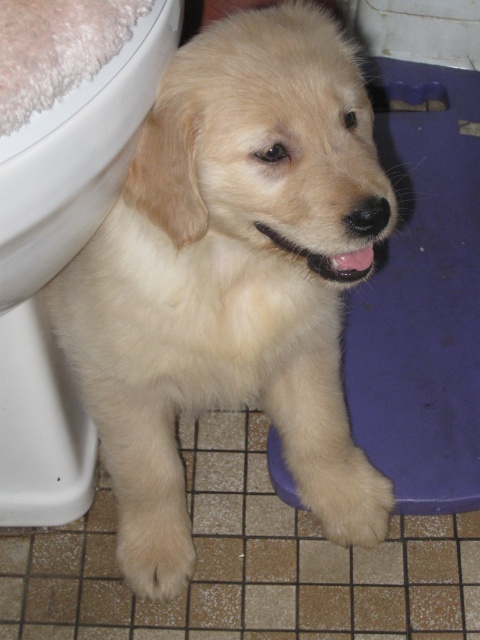
Question: Among these objects, which one is farthest from the camera?

Choices:
 (A) white glossy toilet bowl at lower left
 (B) white fluffy paw at lower left

Answer: (B)

Question: Which object appears farthest from the camera in this image?

Choices:
 (A) white glossy toilet bowl at lower left
 (B) white fluffy paw at lower center

Answer: (B)

Question: Does white glossy toilet bowl at lower left lie in front of white fluffy paw at lower center?

Choices:
 (A) yes
 (B) no

Answer: (A)

Question: Is white fluffy paw at lower center thinner than white fluffy paw at lower left?

Choices:
 (A) no
 (B) yes

Answer: (A)

Question: Can you confirm if white fluffy paw at lower center is smaller than white fluffy paw at lower left?

Choices:
 (A) yes
 (B) no

Answer: (B)

Question: Which point is farther from the camera taking this photo?

Choices:
 (A) (324, 529)
 (B) (154, 513)
 (C) (2, 276)

Answer: (A)